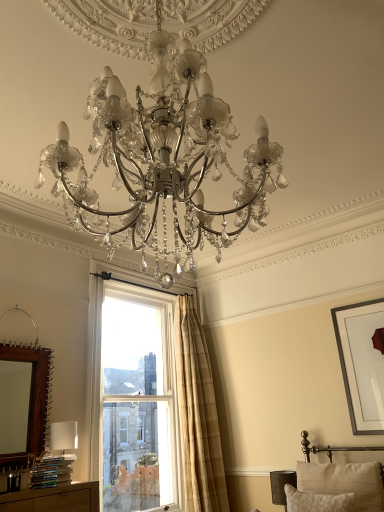
Identify the location of blank space above brown wooden mirror at left (from a real-world perspective). This screenshot has width=384, height=512. (24, 306).